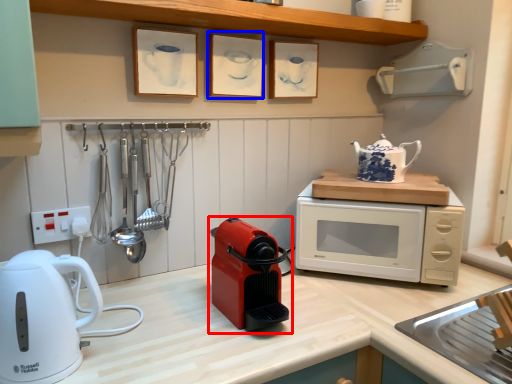
Question: Which point is closer to the camera, home appliance (highlighted by a red box) or picture frame (highlighted by a blue box)?

Choices:
 (A) home appliance
 (B) picture frame

Answer: (A)